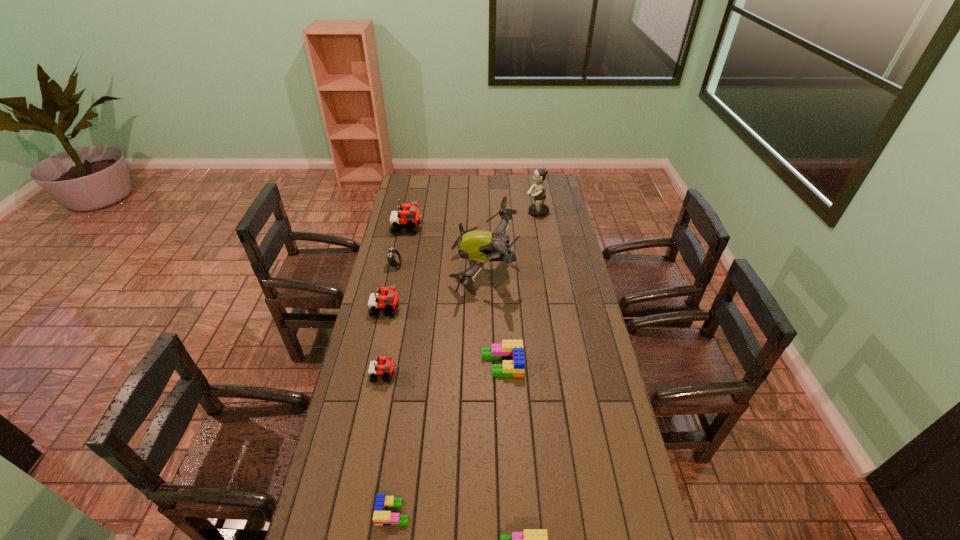
Where is `vacant region at the right edge of the desktop`? The width and height of the screenshot is (960, 540). vacant region at the right edge of the desktop is located at coordinates (569, 316).

In the image, there is a desktop. Where is `blank space at the far left corner`? The image size is (960, 540). blank space at the far left corner is located at coordinates (419, 182).

You are a GUI agent. You are given a task and a screenshot of the screen. Output one action in this format:
    pyautogui.click(x=<x>, y=<y>)
    Task: Click on the vacant space at the far right corner
    The height and width of the screenshot is (540, 960).
    Given the screenshot: What is the action you would take?
    pyautogui.click(x=552, y=187)

Locate an element on the screen. The image size is (960, 540). vacant space that's between the farthest red Lego and the farthest object is located at coordinates 472,220.

The height and width of the screenshot is (540, 960). I want to click on free space between the rightmost object and the eighth farthest object, so click(465, 362).

Identify the location of vacant region between the fourth tallest Lego and the white alarm clock. This screenshot has height=540, width=960. (448, 314).

Find the location of a particular element. free point between the shortest object and the farthest object is located at coordinates point(465,362).

The height and width of the screenshot is (540, 960). What are the coordinates of `free area in between the biggest green Lego and the fifth nearest Lego` in the screenshot? It's located at (444, 337).

Find the location of `vacant space that's between the fourth tallest object and the third shortest Lego`. vacant space that's between the fourth tallest object and the third shortest Lego is located at coordinates (444, 337).

Identify the location of free spot between the third shortest Lego and the drone. The height and width of the screenshot is (540, 960). (492, 318).